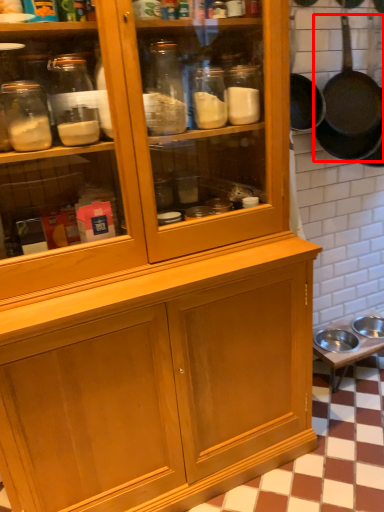
Question: In this image, where is frying pan (annotated by the red box) located relative to table?

Choices:
 (A) left
 (B) right

Answer: (A)